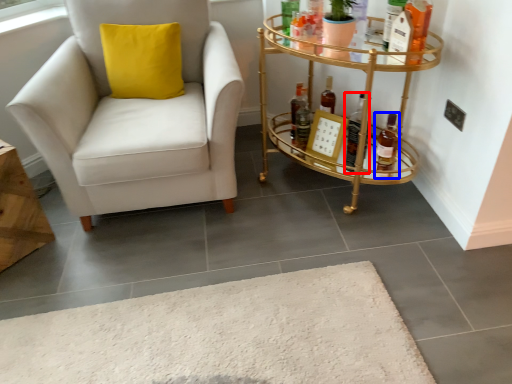
Question: Which object is further to the camera taking this photo, bottle (highlighted by a red box) or bottle (highlighted by a blue box)?

Choices:
 (A) bottle
 (B) bottle

Answer: (A)